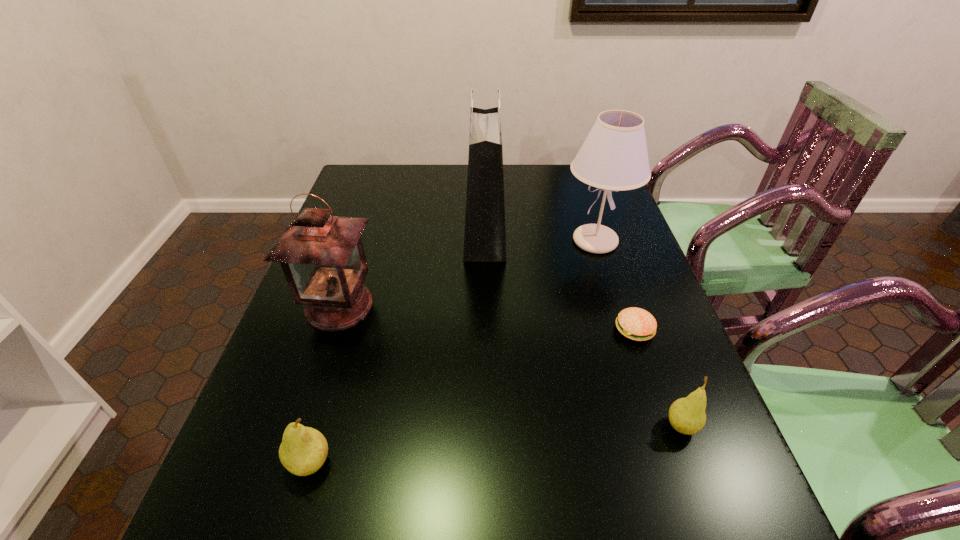
This screenshot has height=540, width=960. I want to click on vacant space in between the third object from left to right and the oil lamp, so click(x=412, y=269).

I want to click on blank region between the oil lamp and the lampshade, so click(468, 273).

I want to click on free space between the patty and the shopping bag, so click(560, 281).

Identify the location of unoccupied position between the third object from left to right and the oil lamp. (412, 269).

Where is `blank region between the patty and the fourth object from right to left`? blank region between the patty and the fourth object from right to left is located at coordinates (560, 281).

This screenshot has height=540, width=960. Find the location of `free space between the shopping bag and the patty`. free space between the shopping bag and the patty is located at coordinates (560, 281).

You are a GUI agent. You are given a task and a screenshot of the screen. Output one action in this format:
    pyautogui.click(x=<x>, y=<y>)
    Task: Click on the unoccupied position between the fifth tallest object and the oil lamp
    
    Given the screenshot: What is the action you would take?
    [511, 366]

You are a GUI agent. You are given a task and a screenshot of the screen. Output one action in this format:
    pyautogui.click(x=<x>, y=<y>)
    Task: Click on the object identified as the third closest to the fourth tallest object
    
    Given the screenshot: What is the action you would take?
    687,415

Locate an element on the screen. object that stands as the closest to the patty is located at coordinates (687, 415).

Locate an element on the screen. The image size is (960, 540). free point that satisfies the following two spatial constraints: 1. on the front with handles of the shopping bag; 2. on the front side of the fourth tallest object is located at coordinates (488, 463).